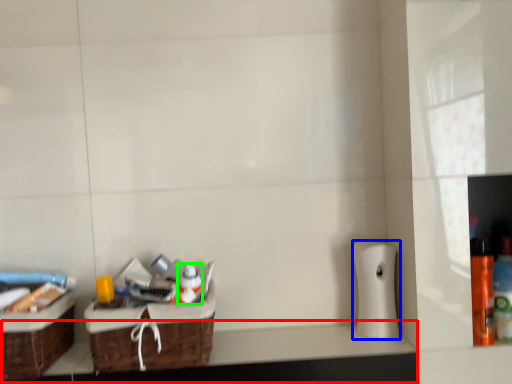
Question: Which object is the closest to the counter top (highlighted by a red box)? Choose among these: toilet paper (highlighted by a blue box) or mouthwash (highlighted by a green box).

Choices:
 (A) toilet paper
 (B) mouthwash

Answer: (A)